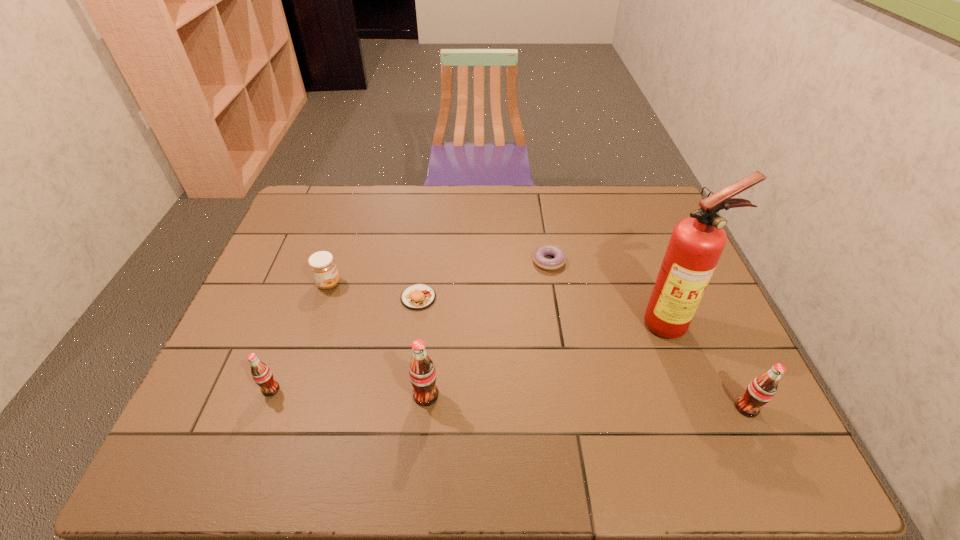
To achieve uniform spacing by inserting another pop_(soda) among them, please point to a free space for this new pop_(soda). Please provide its 2D coordinates. Your answer should be formatted as a tuple, i.e. [(x, y)], where the tuple contains the x and y coordinates of a point satisfying the conditions above.

[(585, 402)]